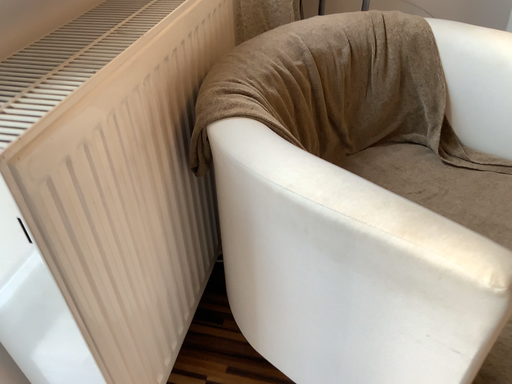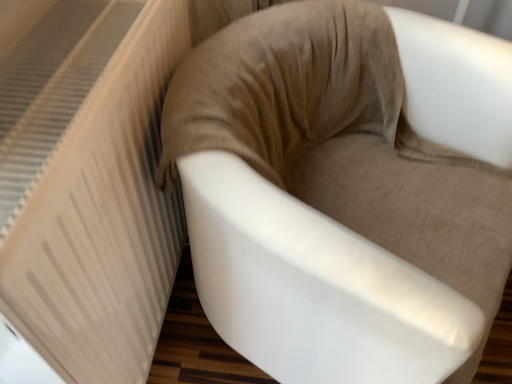
Question: Which way did the camera rotate in the video?

Choices:
 (A) rotated right
 (B) rotated left

Answer: (A)